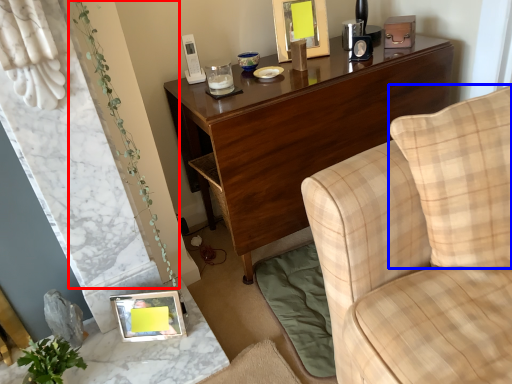
Question: Among these objects, which one is farthest to the camera, plant (highlighted by a red box) or pillow (highlighted by a blue box)?

Choices:
 (A) plant
 (B) pillow

Answer: (A)